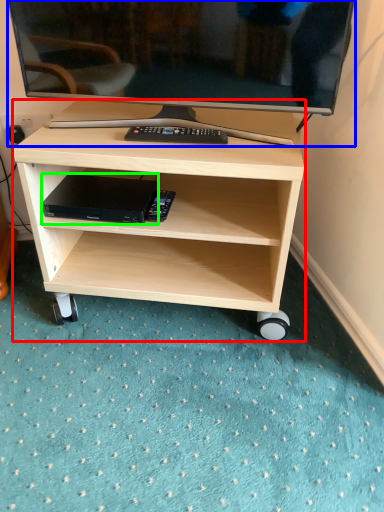
Question: Considering the real-world distances, which object is farthest from desk (highlighted by a red box)? television (highlighted by a blue box) or computer (highlighted by a green box)?

Choices:
 (A) television
 (B) computer

Answer: (A)